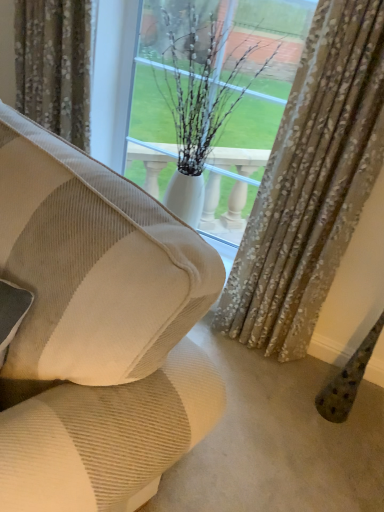
Describe the element at coordinates (311, 183) in the screenshot. I see `textured beige curtain at center, the 2th curtain from the left` at that location.

This screenshot has width=384, height=512. Find the location of `white glossy vase at center`. white glossy vase at center is located at coordinates (213, 99).

Is patterned fabric curtain at upper center, placed as the 1th curtain when sorted from left to right, not inside textured beige curtain at center, the first curtain from the right?

Yes.

Based on the photo, considering the relative sizes of patterned fabric curtain at upper center, marked as the 2th curtain in a right-to-left arrangement, and textured beige curtain at center, the first curtain from the right, in the image provided, is patterned fabric curtain at upper center, marked as the 2th curtain in a right-to-left arrangement, shorter than textured beige curtain at center, the first curtain from the right,?

Correct, patterned fabric curtain at upper center, marked as the 2th curtain in a right-to-left arrangement, is not as tall as textured beige curtain at center, the first curtain from the right.

Considering the positions of objects patterned fabric curtain at upper center, marked as the 2th curtain in a right-to-left arrangement, and textured beige curtain at center, the first curtain from the right, in the image provided, who is behind, patterned fabric curtain at upper center, marked as the 2th curtain in a right-to-left arrangement, or textured beige curtain at center, the first curtain from the right,?

patterned fabric curtain at upper center, marked as the 2th curtain in a right-to-left arrangement, is further away from the camera.

Are patterned fabric curtain at upper center, marked as the 2th curtain in a right-to-left arrangement, and textured beige curtain at center, the first curtain from the right, far apart?

patterned fabric curtain at upper center, marked as the 2th curtain in a right-to-left arrangement, is near textured beige curtain at center, the first curtain from the right, not far away.

Considering the sizes of objects textured beige curtain at center, the 2th curtain from the left, and patterned fabric curtain at upper center, placed as the 1th curtain when sorted from left to right, in the image provided, who is bigger, textured beige curtain at center, the 2th curtain from the left, or patterned fabric curtain at upper center, placed as the 1th curtain when sorted from left to right,?

textured beige curtain at center, the 2th curtain from the left, is bigger.

Is textured beige curtain at center, the first curtain from the right, far away from patterned fabric curtain at upper center, placed as the 1th curtain when sorted from left to right?

Actually, textured beige curtain at center, the first curtain from the right, and patterned fabric curtain at upper center, placed as the 1th curtain when sorted from left to right, are a little close together.

How different are the orientations of textured beige curtain at center, the 2th curtain from the left, and patterned fabric curtain at upper center, marked as the 2th curtain in a right-to-left arrangement, in degrees?

textured beige curtain at center, the 2th curtain from the left, and patterned fabric curtain at upper center, marked as the 2th curtain in a right-to-left arrangement, are facing 0.00135 degrees away from each other.

From the image's perspective, which is below, textured beige curtain at center, the 2th curtain from the left, or patterned fabric curtain at upper center, marked as the 2th curtain in a right-to-left arrangement?

textured beige curtain at center, the 2th curtain from the left, appears lower in the image.

In terms of size, does textured beige curtain at center, the 2th curtain from the left, appear bigger or smaller than beige corduroy couch at center?

Clearly, textured beige curtain at center, the 2th curtain from the left, is smaller in size than beige corduroy couch at center.

Considering the points (352, 165) and (14, 267), which point is in front, point (352, 165) or point (14, 267)?

The point (14, 267) is in front.

Consider the image. How different are the orientations of textured beige curtain at center, the 2th curtain from the left, and beige corduroy couch at center in degrees?

The angle between the facing direction of textured beige curtain at center, the 2th curtain from the left, and the facing direction of beige corduroy couch at center is 23 degrees.

Considering the relative positions of patterned fabric curtain at upper center, placed as the 1th curtain when sorted from left to right, and beige corduroy couch at center in the image provided, is patterned fabric curtain at upper center, placed as the 1th curtain when sorted from left to right, to the left of beige corduroy couch at center from the viewer's perspective?

Indeed, patterned fabric curtain at upper center, placed as the 1th curtain when sorted from left to right, is positioned on the left side of beige corduroy couch at center.

From the image's perspective, count 2nd curtains upward from the beige corduroy couch at center and point to it. Please provide its 2D coordinates.

[(54, 66)]

Consider the image. Could you tell me if patterned fabric curtain at upper center, marked as the 2th curtain in a right-to-left arrangement, is turned towards beige corduroy couch at center?

Yes, patterned fabric curtain at upper center, marked as the 2th curtain in a right-to-left arrangement, is aimed at beige corduroy couch at center.

Between patterned fabric curtain at upper center, placed as the 1th curtain when sorted from left to right, and beige corduroy couch at center, which one is positioned in front?

beige corduroy couch at center.

Is beige corduroy couch at center not near white glossy vase at center?

Yes, beige corduroy couch at center and white glossy vase at center are quite far apart.

Is beige corduroy couch at center in front of or behind white glossy vase at center in the image?

In the image, beige corduroy couch at center appears in front of white glossy vase at center.

Could you tell me if beige corduroy couch at center is facing white glossy vase at center?

No, beige corduroy couch at center is not aimed at white glossy vase at center.

Does beige corduroy couch at center appear on the right side of white glossy vase at center?

Incorrect, beige corduroy couch at center is not on the right side of white glossy vase at center.

Could you tell me if beige corduroy couch at center is turned towards textured beige curtain at center, the 2th curtain from the left?

No, beige corduroy couch at center is not facing towards textured beige curtain at center, the 2th curtain from the left.

Can you tell me how much beige corduroy couch at center and textured beige curtain at center, the first curtain from the right, differ in facing direction?

beige corduroy couch at center and textured beige curtain at center, the first curtain from the right, are facing 23 degrees away from each other.

Who is shorter, beige corduroy couch at center or textured beige curtain at center, the 2th curtain from the left?

Standing shorter between the two is beige corduroy couch at center.

Consider the image. Do you think beige corduroy couch at center is within textured beige curtain at center, the 2th curtain from the left, or outside of it?

beige corduroy couch at center is located beyond the bounds of textured beige curtain at center, the 2th curtain from the left.

From the image's perspective, is patterned fabric curtain at upper center, placed as the 1th curtain when sorted from left to right, over white glossy vase at center?

Yes, from the image's perspective, patterned fabric curtain at upper center, placed as the 1th curtain when sorted from left to right, is over white glossy vase at center.

Locate an element on the screen. This screenshot has height=512, width=384. curtain above the white glossy vase at center (from the image's perspective) is located at coordinates (54, 66).

Which point is more distant from viewer, (73,68) or (270,101)?

The point (270,101) is farther from the camera.

What are the coordinates of `curtain lying below the patterned fabric curtain at upper center, placed as the 1th curtain when sorted from left to right (from the image's perspective)` in the screenshot? It's located at (311, 183).

In order to click on curtain located behind the textured beige curtain at center, the first curtain from the right in this screenshot , I will do `click(54, 66)`.

Estimate the real-world distances between objects in this image. Which object is closer to white glossy vase at center, beige corduroy couch at center or patterned fabric curtain at upper center, marked as the 2th curtain in a right-to-left arrangement?

The object closer to white glossy vase at center is patterned fabric curtain at upper center, marked as the 2th curtain in a right-to-left arrangement.

Based on their spatial positions, is beige corduroy couch at center or white glossy vase at center closer to patterned fabric curtain at upper center, marked as the 2th curtain in a right-to-left arrangement?

The object closer to patterned fabric curtain at upper center, marked as the 2th curtain in a right-to-left arrangement, is white glossy vase at center.

Based on their spatial positions, is white glossy vase at center or beige corduroy couch at center further from textured beige curtain at center, the first curtain from the right?

beige corduroy couch at center is positioned further to the anchor textured beige curtain at center, the first curtain from the right.

Looking at the image, which one is located closer to beige corduroy couch at center, textured beige curtain at center, the 2th curtain from the left, or patterned fabric curtain at upper center, placed as the 1th curtain when sorted from left to right?

textured beige curtain at center, the 2th curtain from the left, is closer to beige corduroy couch at center.

Based on their spatial positions, is beige corduroy couch at center or textured beige curtain at center, the first curtain from the right, closer to patterned fabric curtain at upper center, marked as the 2th curtain in a right-to-left arrangement?

textured beige curtain at center, the first curtain from the right, is positioned closer to the anchor patterned fabric curtain at upper center, marked as the 2th curtain in a right-to-left arrangement.

Considering their positions, is patterned fabric curtain at upper center, marked as the 2th curtain in a right-to-left arrangement, positioned closer to textured beige curtain at center, the 2th curtain from the left, than white glossy vase at center?

white glossy vase at center is positioned closer to the anchor textured beige curtain at center, the 2th curtain from the left.

Based on their spatial positions, is patterned fabric curtain at upper center, marked as the 2th curtain in a right-to-left arrangement, or beige corduroy couch at center closer to white glossy vase at center?

patterned fabric curtain at upper center, marked as the 2th curtain in a right-to-left arrangement, is positioned closer to the anchor white glossy vase at center.

Looking at the image, which one is located further to patterned fabric curtain at upper center, marked as the 2th curtain in a right-to-left arrangement, white glossy vase at center or beige corduroy couch at center?

The object further to patterned fabric curtain at upper center, marked as the 2th curtain in a right-to-left arrangement, is beige corduroy couch at center.

Locate an element on the screen. Image resolution: width=384 pixels, height=512 pixels. window positioned between beige corduroy couch at center and patterned fabric curtain at upper center, marked as the 2th curtain in a right-to-left arrangement, from near to far is located at coordinates (213, 99).

The height and width of the screenshot is (512, 384). Find the location of `window located between patterned fabric curtain at upper center, placed as the 1th curtain when sorted from left to right, and textured beige curtain at center, the 2th curtain from the left, in the left-right direction`. window located between patterned fabric curtain at upper center, placed as the 1th curtain when sorted from left to right, and textured beige curtain at center, the 2th curtain from the left, in the left-right direction is located at coordinates (213, 99).

Where is `studio couch between patterned fabric curtain at upper center, placed as the 1th curtain when sorted from left to right, and textured beige curtain at center, the 2th curtain from the left, in the horizontal direction`? studio couch between patterned fabric curtain at upper center, placed as the 1th curtain when sorted from left to right, and textured beige curtain at center, the 2th curtain from the left, in the horizontal direction is located at coordinates coord(97,330).

The image size is (384, 512). I want to click on curtain located between beige corduroy couch at center and white glossy vase at center in the depth direction, so click(x=311, y=183).